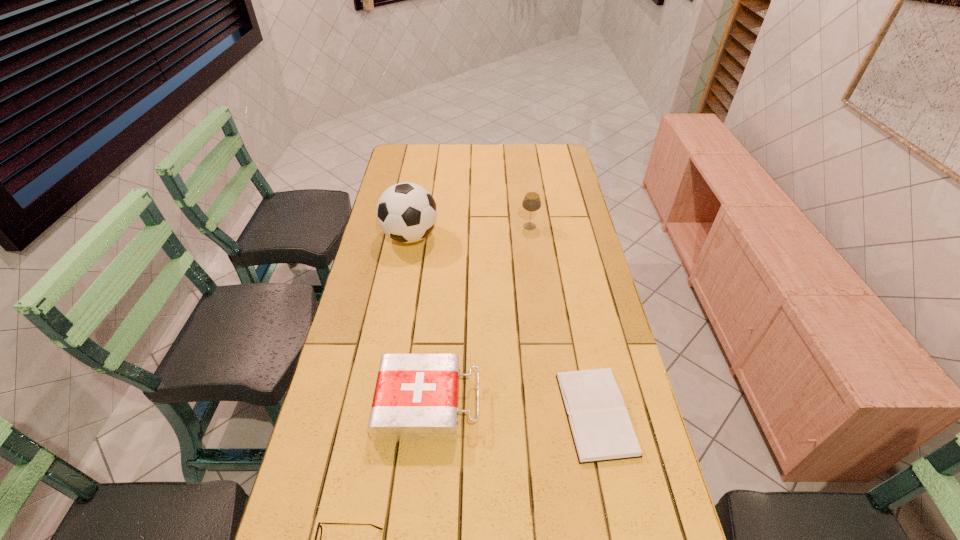
Locate an element on the screen. This screenshot has width=960, height=540. object at the right edge is located at coordinates (601, 429).

Locate an element on the screen. The image size is (960, 540). free space at the far edge of the desktop is located at coordinates (511, 158).

I want to click on blank area at the left edge, so click(x=391, y=298).

The height and width of the screenshot is (540, 960). In the image, there is a desktop. Find the location of `vacant space at the far right corner`. vacant space at the far right corner is located at coordinates (555, 150).

You are a GUI agent. You are given a task and a screenshot of the screen. Output one action in this format:
    pyautogui.click(x=<x>, y=<y>)
    Task: Click on the free spot between the shortest object and the soccer ball
    This screenshot has width=960, height=540.
    Given the screenshot: What is the action you would take?
    pyautogui.click(x=503, y=325)

Where is `vacant region between the shortest object and the soccer ball`? vacant region between the shortest object and the soccer ball is located at coordinates (503, 325).

Identify which object is the third closest to the second tallest object. Please provide its 2D coordinates. Your answer should be formatted as a tuple, i.e. [(x, y)], where the tuple contains the x and y coordinates of a point satisfying the conditions above.

[(416, 396)]

This screenshot has height=540, width=960. In order to click on object that can be found as the second closest to the soccer ball in this screenshot , I will do `click(416, 396)`.

What are the coordinates of `vacant space that satisfies the following two spatial constraints: 1. on the front side of the fourth shortest object; 2. on the front side of the third tallest object` in the screenshot? It's located at (553, 403).

Identify the location of free space that satisfies the following two spatial constraints: 1. on the front side of the fourth shortest object; 2. on the right side of the shortest object. point(554,414).